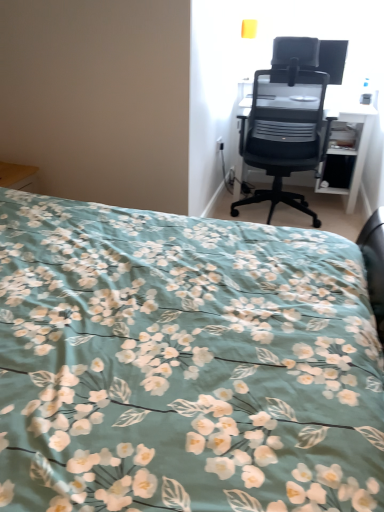
Question: Should I look upward or downward to see teal floral fabric bed at lower left?

Choices:
 (A) down
 (B) up

Answer: (B)